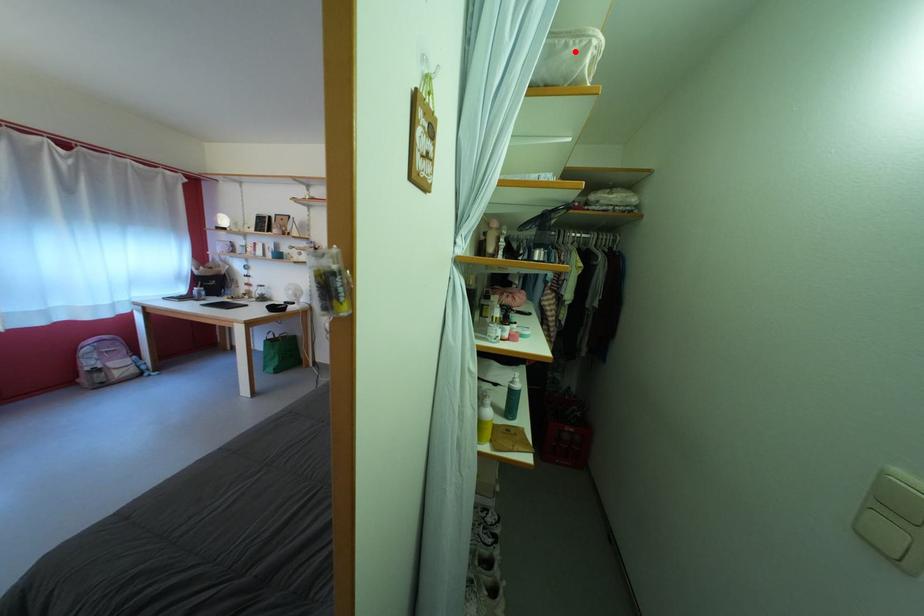
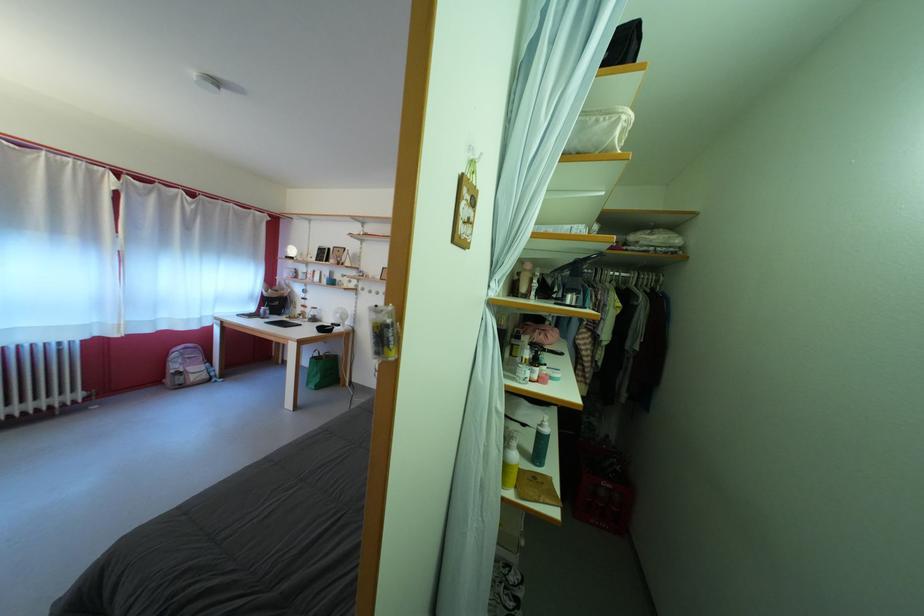
In the second image, find the point that corresponds to the highlighted location in the first image.

(605, 128)